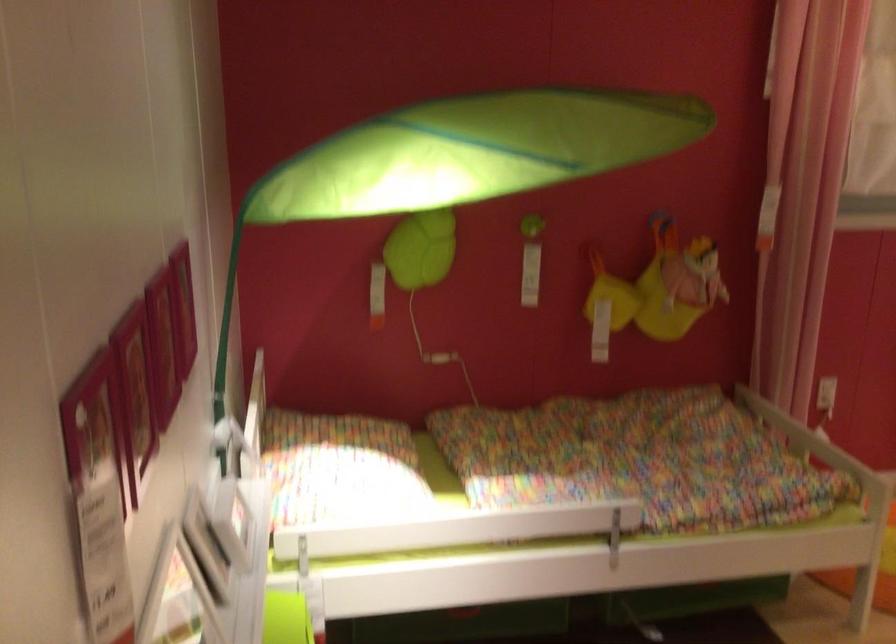
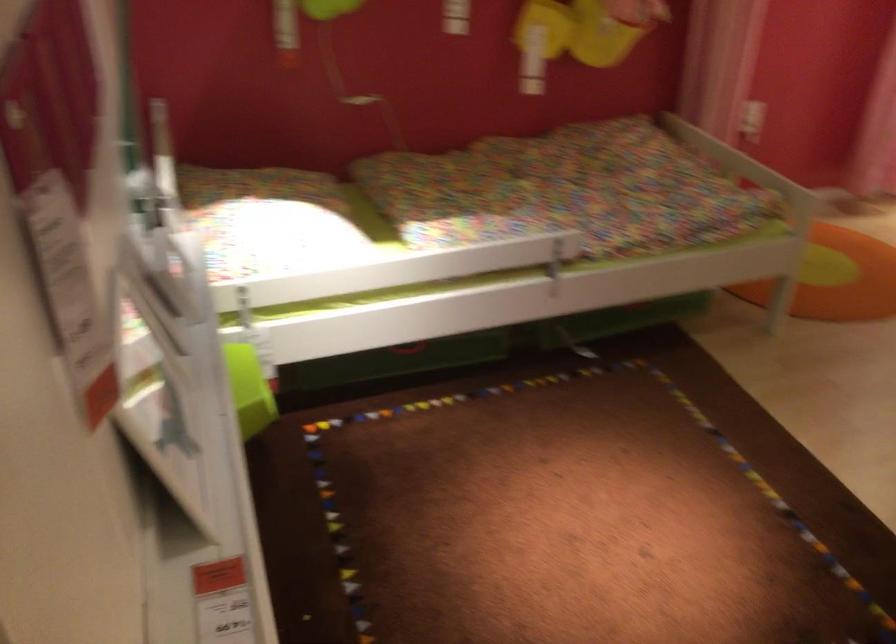
Question: The first image is from the beginning of the video and the second image is from the end. How did the camera likely rotate when shooting the video?

Choices:
 (A) Left
 (B) Right
 (C) Up
 (D) Down

Answer: (D)